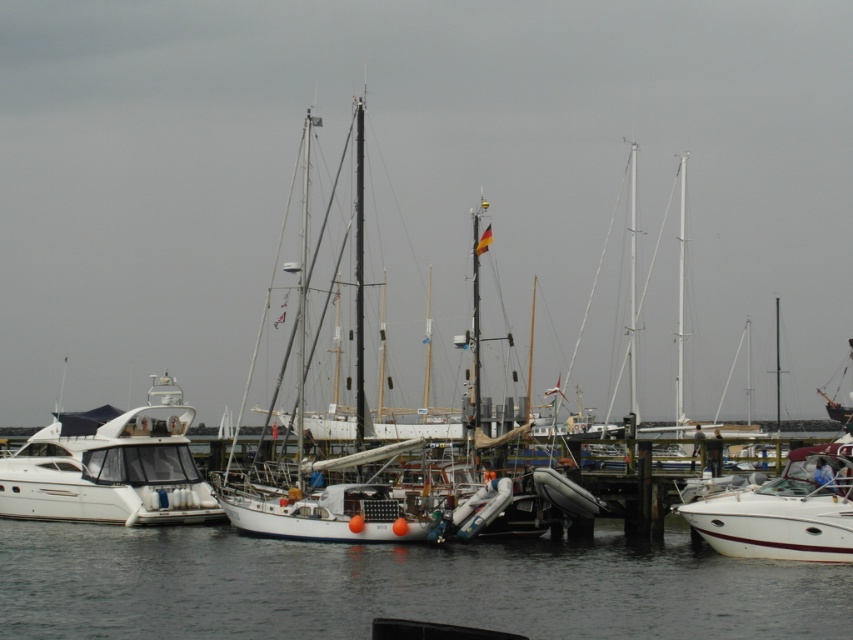
Is the position of transparent water at center more distant than that of white glossy speedboat at right?

No, it is not.

Does transparent water at center come in front of white glossy speedboat at right?

That is True.

Locate an element on the screen. The image size is (853, 640). transparent water at center is located at coordinates (398, 586).

Locate an element on the screen. transparent water at center is located at coordinates (398, 586).

Looking at this image, which of these two, white glossy motorboat at left or white glossy speedboat at right, stands taller?

With more height is white glossy motorboat at left.

Can you confirm if white glossy motorboat at left is wider than white glossy speedboat at right?

Indeed, white glossy motorboat at left has a greater width compared to white glossy speedboat at right.

Does point (86, 496) lie behind point (779, 544)?

Yes, point (86, 496) is behind point (779, 544).

The height and width of the screenshot is (640, 853). I want to click on white glossy motorboat at left, so click(111, 467).

Does transparent water at center lie in front of white glossy motorboat at left?

That is True.

I want to click on transparent water at center, so click(398, 586).

Locate an element on the screen. The width and height of the screenshot is (853, 640). transparent water at center is located at coordinates (398, 586).